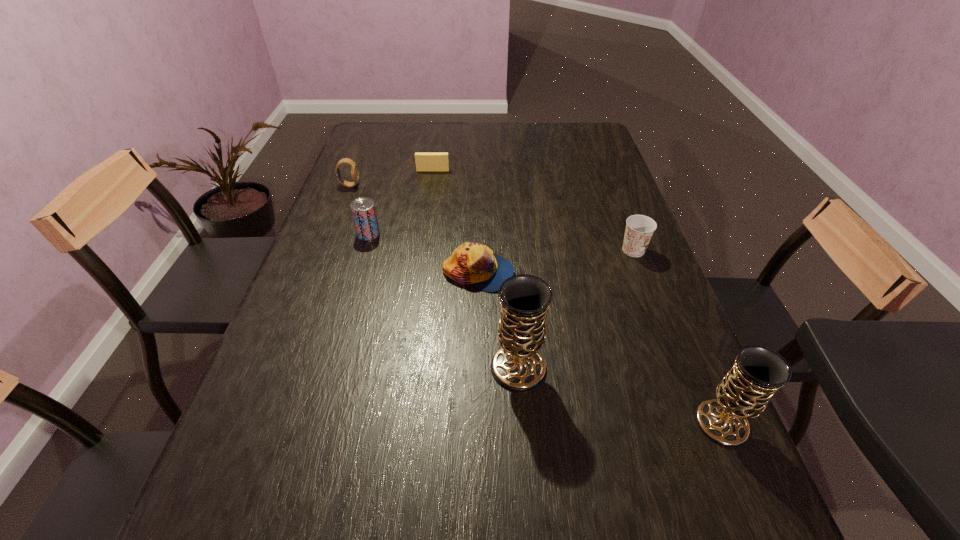
Identify which object is the sixth nearest to the fifth nearest object. Please provide its 2D coordinates. Your answer should be formatted as a tuple, i.e. [(x, y)], where the tuple contains the x and y coordinates of a point satisfying the conditions above.

[(758, 372)]

The width and height of the screenshot is (960, 540). What are the coordinates of `the fifth closest object to the Dixie cup` in the screenshot? It's located at (363, 209).

Find the location of a particular element. free space that satisfies the following two spatial constraints: 1. on the face of the second nearest object; 2. on the right side of the watch is located at coordinates (278, 367).

This screenshot has height=540, width=960. I want to click on vacant space that satisfies the following two spatial constraints: 1. on the bill of the cap; 2. on the back side of the nearer chalice, so click(477, 422).

Find the location of a particular element. This screenshot has width=960, height=540. free space in the image that satisfies the following two spatial constraints: 1. on the back side of the nearest object; 2. on the bill of the cap is located at coordinates (659, 273).

The width and height of the screenshot is (960, 540). In order to click on vacant area in the image that satisfies the following two spatial constraints: 1. on the face of the sixth shortest object; 2. on the right side of the watch in this screenshot , I will do `click(257, 422)`.

Where is `vacant space that satisfies the following two spatial constraints: 1. on the face of the shorter chalice; 2. on the right side of the second farthest object`? vacant space that satisfies the following two spatial constraints: 1. on the face of the shorter chalice; 2. on the right side of the second farthest object is located at coordinates (257, 422).